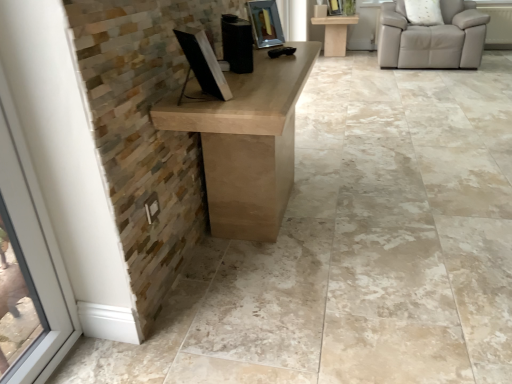
Question: Is metallic reflective picture frame at upper center, positioned as the 1th picture frame in left-to-right order, shorter than beige leather chair at upper right?

Choices:
 (A) yes
 (B) no

Answer: (A)

Question: From a real-world perspective, is metallic reflective picture frame at upper center, which is the second picture frame from back to front, located beneath beige leather chair at upper right?

Choices:
 (A) no
 (B) yes

Answer: (A)

Question: From the image's perspective, is metallic reflective picture frame at upper center, which is the second picture frame from back to front, below beige leather chair at upper right?

Choices:
 (A) no
 (B) yes

Answer: (B)

Question: Is metallic reflective picture frame at upper center, marked as the 1th picture frame in a bottom-to-top arrangement, beside beige leather chair at upper right?

Choices:
 (A) no
 (B) yes

Answer: (A)

Question: Is beige leather chair at upper right at the back of metallic reflective picture frame at upper center, positioned as the second picture frame in top-to-bottom order?

Choices:
 (A) yes
 (B) no

Answer: (B)

Question: From a real-world perspective, is metallic reflective picture frame at upper center, which is the second picture frame from back to front, positioned over beige leather chair at upper right based on gravity?

Choices:
 (A) no
 (B) yes

Answer: (B)

Question: Can you confirm if matte silver picture frame at upper center, the first picture frame when ordered from back to front, is positioned to the right of matte beige table at upper center?

Choices:
 (A) no
 (B) yes

Answer: (A)

Question: From the image's perspective, is matte silver picture frame at upper center, which ranks as the 2th picture frame in bottom-to-top order, under matte beige table at upper center?

Choices:
 (A) yes
 (B) no

Answer: (B)

Question: Can you see matte silver picture frame at upper center, the 2th picture frame viewed from the left, touching matte beige table at upper center?

Choices:
 (A) yes
 (B) no

Answer: (B)

Question: Considering the relative sizes of matte silver picture frame at upper center, marked as the second picture frame in a front-to-back arrangement, and matte beige table at upper center in the image provided, is matte silver picture frame at upper center, marked as the second picture frame in a front-to-back arrangement, bigger than matte beige table at upper center?

Choices:
 (A) no
 (B) yes

Answer: (A)

Question: Are matte silver picture frame at upper center, marked as the second picture frame in a front-to-back arrangement, and matte beige table at upper center far apart?

Choices:
 (A) yes
 (B) no

Answer: (B)

Question: Could matte beige table at upper center be considered to be inside matte silver picture frame at upper center, the 2th picture frame viewed from the left?

Choices:
 (A) no
 (B) yes

Answer: (A)

Question: Does matte beige table at upper center lie in front of beige leather chair at upper right?

Choices:
 (A) no
 (B) yes

Answer: (A)